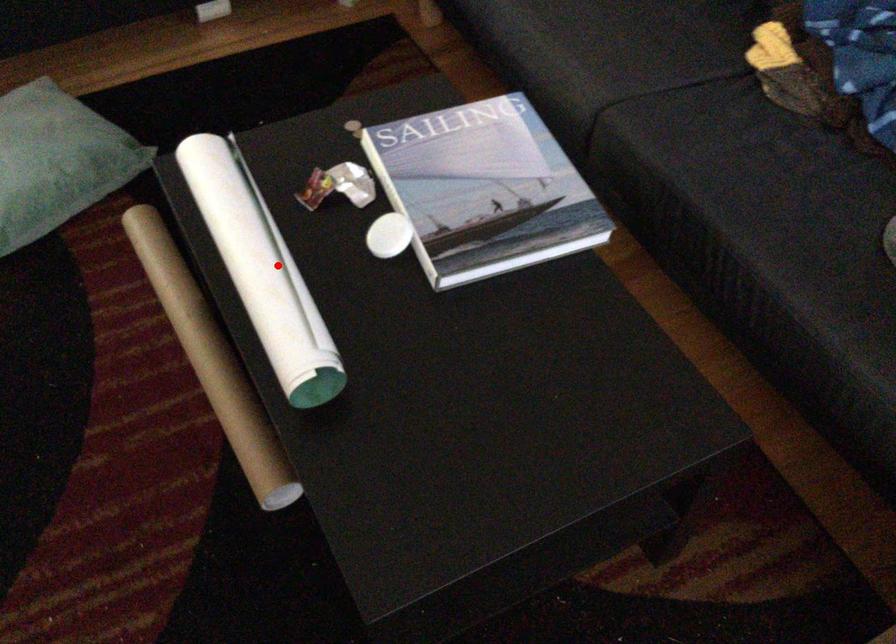
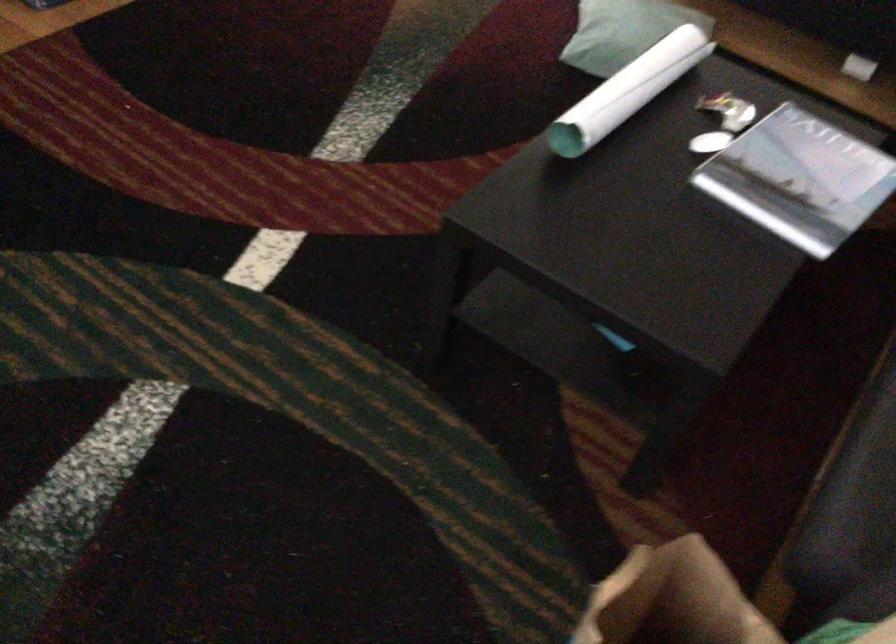
Where in the second image is the point corresponding to the highlighted location from the first image?

(626, 91)